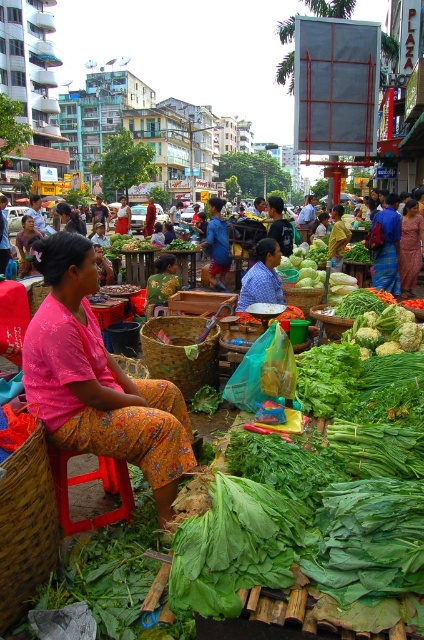
Between point (13, 620) and point (250, 618), which one is positioned in front?

Positioned in front is point (250, 618).

Is point (0, 620) positioned after point (276, 589)?

Yes, point (0, 620) is behind point (276, 589).

The image size is (424, 640). Find the location of `brown woven basket at lower left`. brown woven basket at lower left is located at coordinates (25, 525).

Is the position of green textured blouse at center less distant than that of woven bamboo basket at lower left?

That is False.

Between green textured blouse at center and woven bamboo basket at lower left, which one has more height?

green textured blouse at center

Does point (147, 282) lie in front of point (147, 376)?

No, (147, 282) is further to viewer.

The image size is (424, 640). I want to click on green textured blouse at center, so click(x=161, y=282).

Does green textured blouse at center appear over woven bamboo basket at center?

Yes, green textured blouse at center is above woven bamboo basket at center.

Is point (159, 273) less distant than point (304, 298)?

No, (159, 273) is further to viewer.

Where is `green textured blouse at center`? green textured blouse at center is located at coordinates (161, 282).